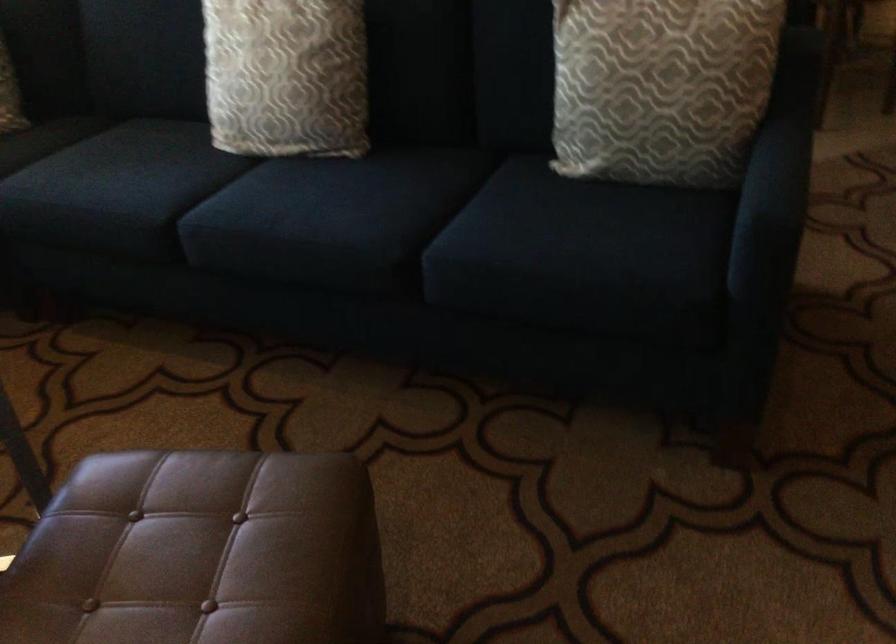
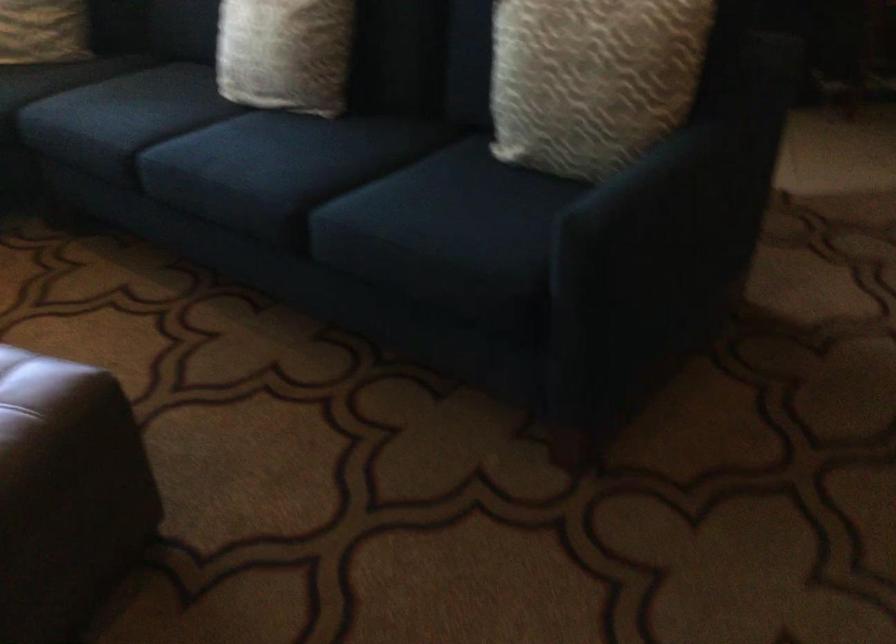
Where in the second image is the point corresponding to [665,87] from the first image?

(591, 80)